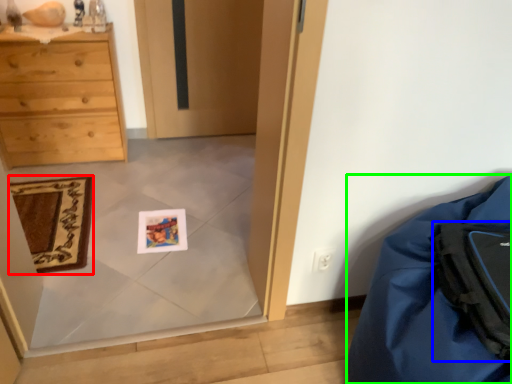
Question: Which object is the closest to the mat (highlighted by a red box)? Choose among these: backpack (highlighted by a blue box) or furniture (highlighted by a green box).

Choices:
 (A) backpack
 (B) furniture

Answer: (B)